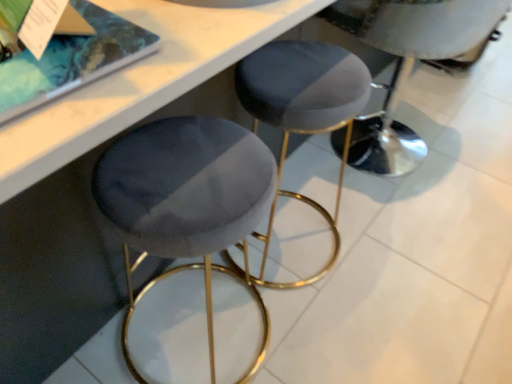
Identify the location of vacant space underneath velvet grey stool at center (from a real-world perspective). (291, 239).